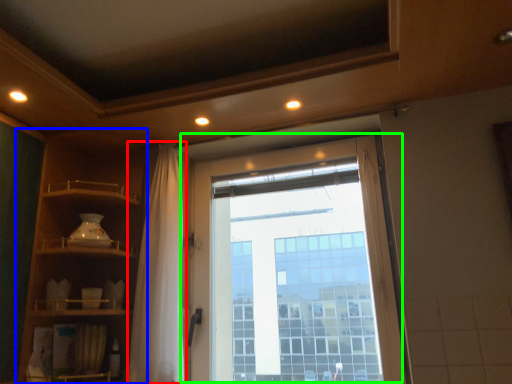
Question: Based on their relative distances, which object is farther from shower curtain (highlighted by a red box)? Choose from shelf (highlighted by a blue box) and window (highlighted by a green box).

Choices:
 (A) shelf
 (B) window

Answer: (B)